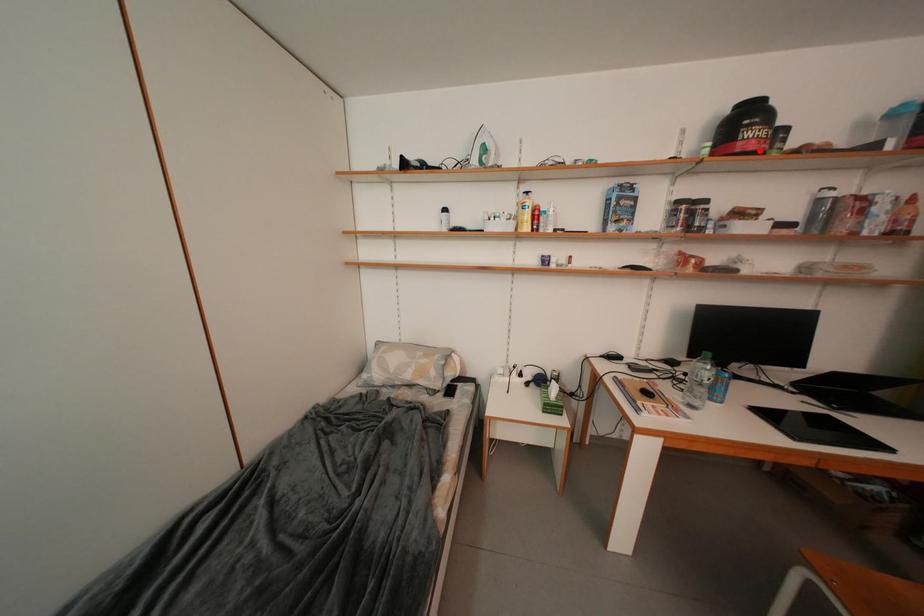
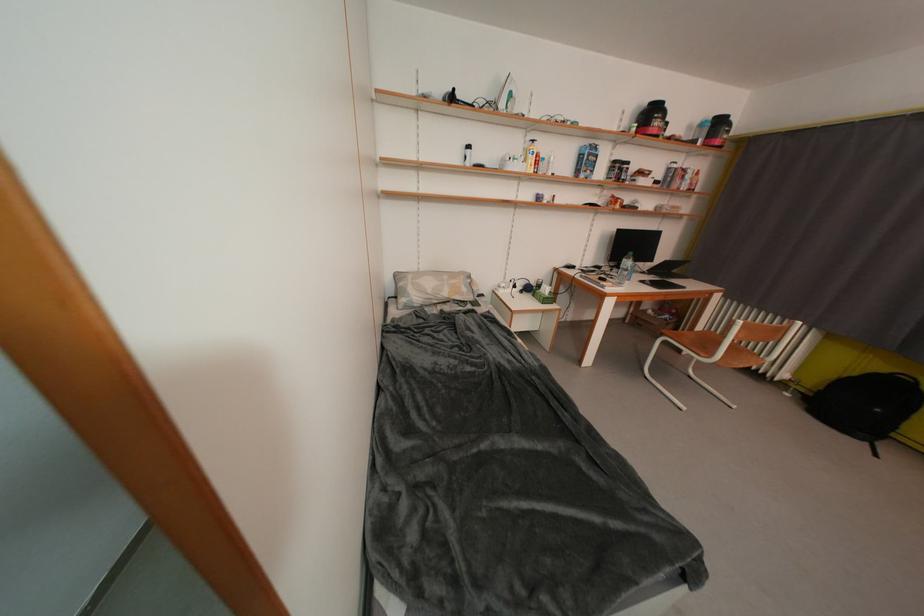
Question: A red point is marked in image1. In image2, is the corresponding 3D point closer to the camera or farther? Reply with the corresponding letter.

Choices:
 (A) The corresponding 3D point is closer.
 (B) The corresponding 3D point is farther.

Answer: (A)